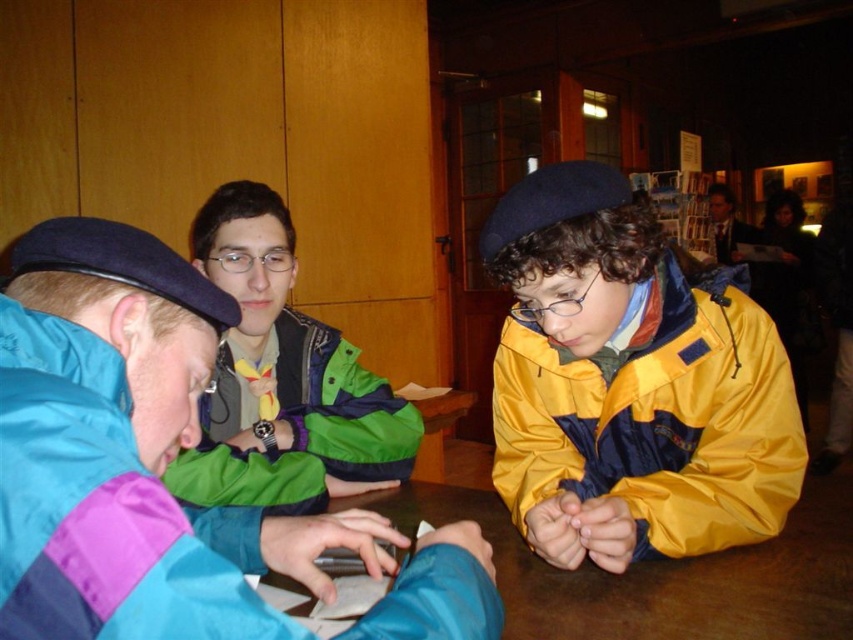
Question: Does matte blue jacket at left appear over formal suit at upper right?

Choices:
 (A) yes
 (B) no

Answer: (B)

Question: Does green matte jacket at center lie in front of formal suit at upper right?

Choices:
 (A) no
 (B) yes

Answer: (B)

Question: Which point is farther to the camera?

Choices:
 (A) (546, 604)
 (B) (138, 340)
 (C) (383, 461)
 (D) (546, 531)

Answer: (C)

Question: Which of the following is the farthest from the observer?

Choices:
 (A) (711, 333)
 (B) (364, 461)

Answer: (B)

Question: Does yellow matte jacket at center have a greater width compared to green matte jacket at center?

Choices:
 (A) yes
 (B) no

Answer: (A)

Question: Among these objects, which one is nearest to the camera?

Choices:
 (A) formal suit at upper right
 (B) green matte jacket at center

Answer: (B)